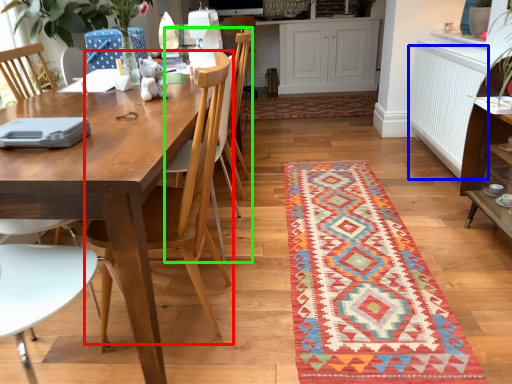
Question: Considering the real-world distances, which object is farthest from chair (highlighted by a red box)? radiator (highlighted by a blue box) or armchair (highlighted by a green box)?

Choices:
 (A) radiator
 (B) armchair

Answer: (A)